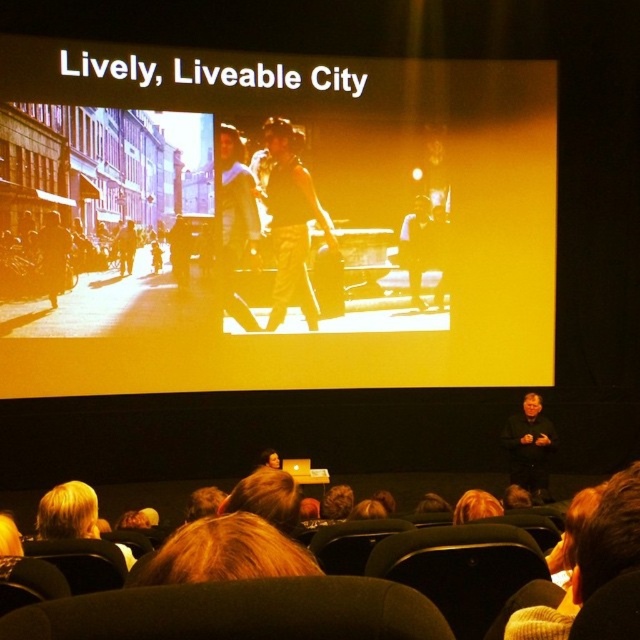
You are an attendee sitting in the front row of the lecture hall. You notice two items in the scene described. The first is the black fabric at lower right and the second is the dark brown leather jacket at left. Which of these two items is bigger in size?

The black fabric at lower right has a larger size compared to dark brown leather jacket at left, so the black fabric at lower right is bigger in size.

You are sitting in the audience and want to know which point is closer to you. The points are point at coordinates point (252,182) and point at coordinates point (45,250). Which point is closer to you?

Point at coordinates point (45,250) is closer to you because it is less further to the viewer than point at coordinates point (252,182).